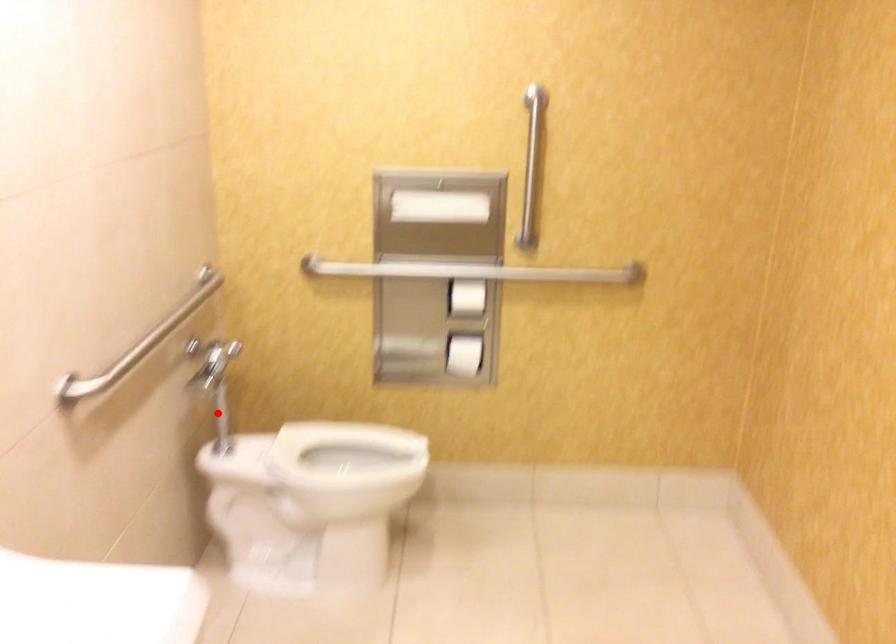
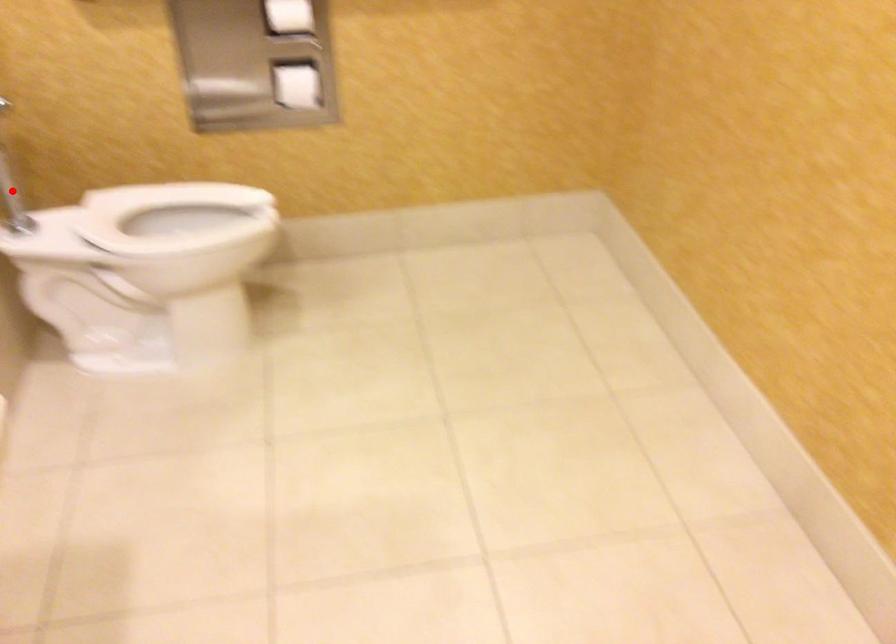
I am providing you with two images of the same scene from different viewpoints. A red point is marked on the first image and another point is marked on the second image. Is the red point in image1 aligned with the point shown in image2?

Yes